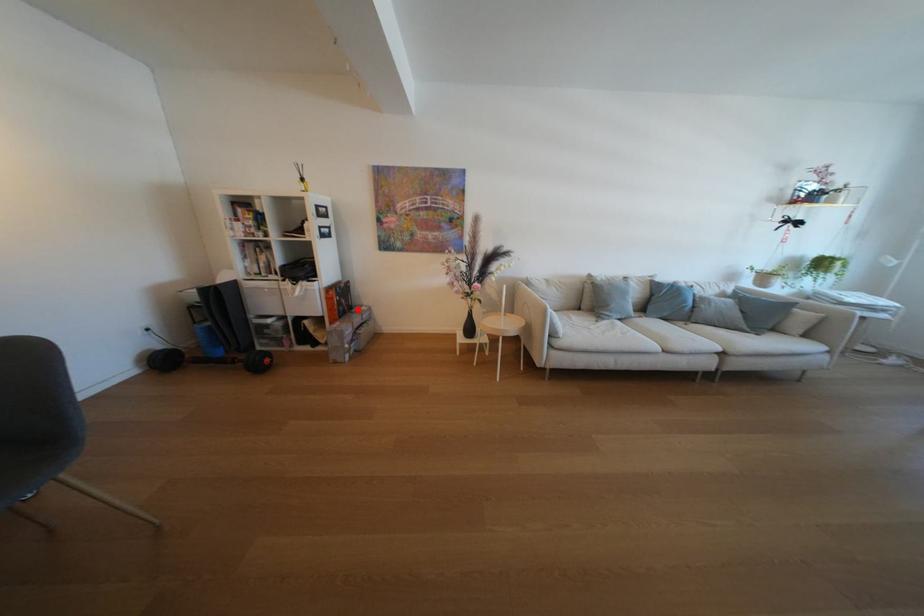
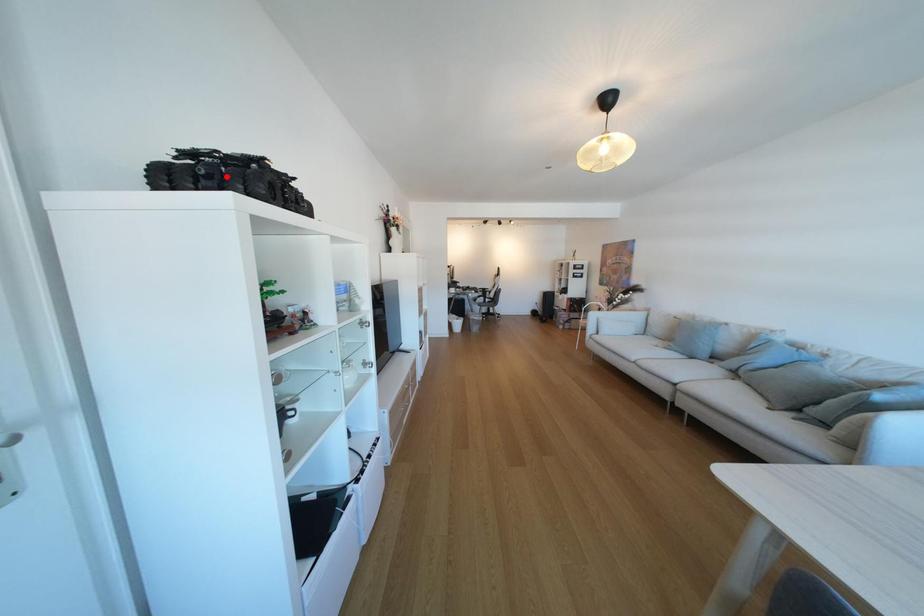
Consider the image. I am providing you with two images of the same scene from different viewpoints. A red point is marked on the first image and another point is marked on the second image. Are the points marked in image1 and image2 representing the same 3D position?

No